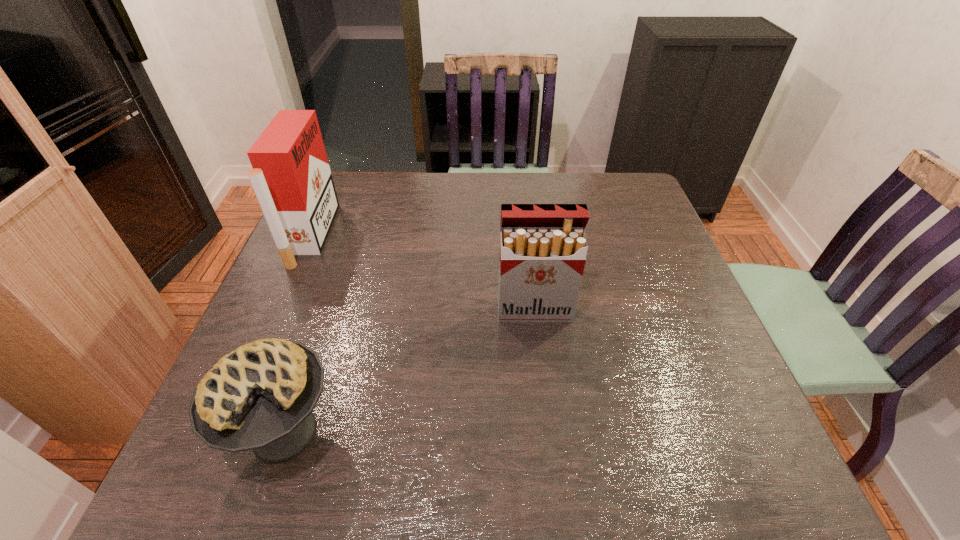
The width and height of the screenshot is (960, 540). Identify the location of free space between the nearest object and the farther cigarette case. (299, 334).

Image resolution: width=960 pixels, height=540 pixels. I want to click on blank region between the nearest object and the left cigarette case, so click(299, 334).

I want to click on object that is the second closest one to the pie, so click(x=543, y=247).

Select which object appears as the second closest to the pie. Please provide its 2D coordinates. Your answer should be formatted as a tuple, i.e. [(x, y)], where the tuple contains the x and y coordinates of a point satisfying the conditions above.

[(543, 247)]